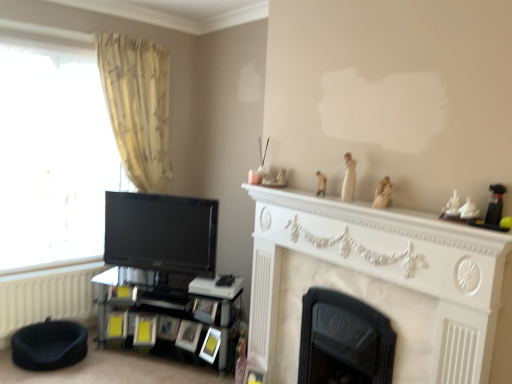
Question: Could you tell me if white textured radiator at lower left is turned towards black glossy tv at left?

Choices:
 (A) yes
 (B) no

Answer: (B)

Question: Is white textured radiator at lower left beside black glossy tv at left?

Choices:
 (A) no
 (B) yes

Answer: (A)

Question: Is white textured radiator at lower left at the right side of black glossy tv at left?

Choices:
 (A) no
 (B) yes

Answer: (A)

Question: Can you confirm if white textured radiator at lower left is shorter than black glossy tv at left?

Choices:
 (A) yes
 (B) no

Answer: (A)

Question: From the image's perspective, does white textured radiator at lower left appear higher than black glossy tv at left?

Choices:
 (A) yes
 (B) no

Answer: (B)

Question: Would you say transparent glass window at left is inside or outside dark blue fabric bean bag chair at lower left?

Choices:
 (A) inside
 (B) outside

Answer: (B)

Question: Considering the relative positions of transparent glass window at left and dark blue fabric bean bag chair at lower left in the image provided, is transparent glass window at left to the left or to the right of dark blue fabric bean bag chair at lower left?

Choices:
 (A) left
 (B) right

Answer: (A)

Question: From the image's perspective, is transparent glass window at left positioned above or below dark blue fabric bean bag chair at lower left?

Choices:
 (A) above
 (B) below

Answer: (A)

Question: Considering their positions, is transparent glass window at left located in front of or behind dark blue fabric bean bag chair at lower left?

Choices:
 (A) front
 (B) behind

Answer: (B)

Question: In terms of size, does white porcelain figurine at upper right appear bigger or smaller than transparent glass window at left?

Choices:
 (A) big
 (B) small

Answer: (B)

Question: Is point (377, 203) positioned closer to the camera than point (75, 256)?

Choices:
 (A) farther
 (B) closer

Answer: (B)

Question: Looking at their shapes, would you say white porcelain figurine at upper right is wider or thinner than transparent glass window at left?

Choices:
 (A) wide
 (B) thin

Answer: (B)

Question: From the image's perspective, is white porcelain figurine at upper right above or below transparent glass window at left?

Choices:
 (A) below
 (B) above

Answer: (A)

Question: In the image, is black glossy tv at left positioned in front of or behind black glossy shelf at lower left?

Choices:
 (A) behind
 (B) front

Answer: (A)

Question: Considering the positions of black glossy tv at left and black glossy shelf at lower left in the image, is black glossy tv at left bigger or smaller than black glossy shelf at lower left?

Choices:
 (A) small
 (B) big

Answer: (A)